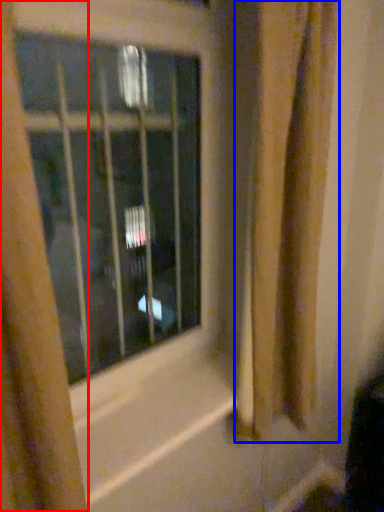
Question: Which of the following is the closest to the observer, curtain (highlighted by a red box) or shower curtain (highlighted by a blue box)?

Choices:
 (A) curtain
 (B) shower curtain

Answer: (A)